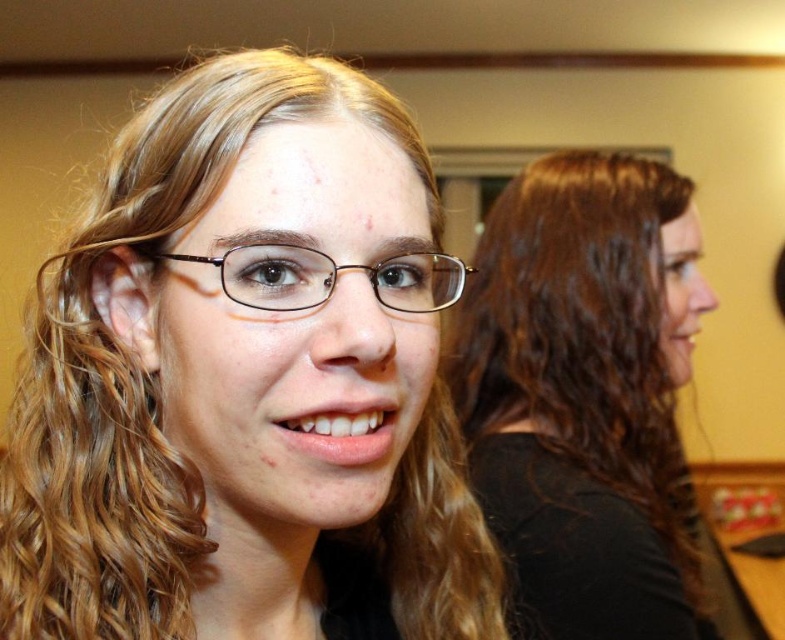
Question: Does matte black hair at center have a lesser width compared to dark brown hair at upper right?

Choices:
 (A) yes
 (B) no

Answer: (A)

Question: Which object appears closest to the camera in this image?

Choices:
 (A) matte black hair at center
 (B) brown plastic glasses at center

Answer: (A)

Question: In this image, where is matte black hair at center located relative to dark brown hair at upper right?

Choices:
 (A) right
 (B) left

Answer: (B)

Question: Based on their relative distances, which object is farther from the dark brown hair at upper right?

Choices:
 (A) matte black hair at center
 (B) brown plastic glasses at center

Answer: (B)

Question: Does matte black hair at center have a larger size compared to dark brown hair at upper right?

Choices:
 (A) no
 (B) yes

Answer: (A)

Question: Among these objects, which one is farthest from the camera?

Choices:
 (A) brown plastic glasses at center
 (B) dark brown hair at upper right
 (C) matte black hair at center

Answer: (B)